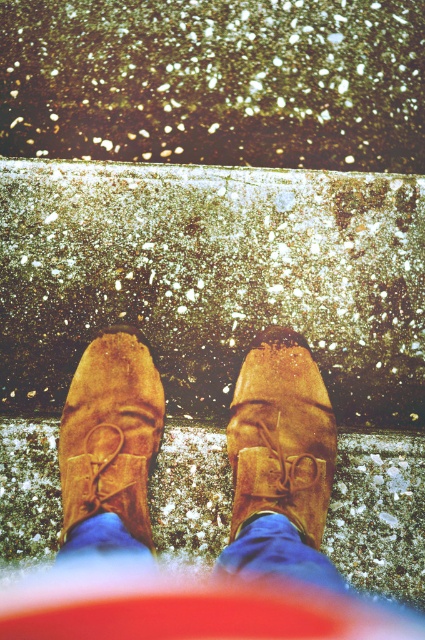
Is suede brown shoe at center taller than brown suede shoe at center?

Yes, suede brown shoe at center is taller than brown suede shoe at center.

Is point (115, 330) positioned after point (269, 429)?

Yes, it is behind point (269, 429).

Is point (130, 401) behind point (232, 428)?

Yes, it is.

The height and width of the screenshot is (640, 425). In order to click on suede brown shoe at center in this screenshot , I will do `click(110, 435)`.